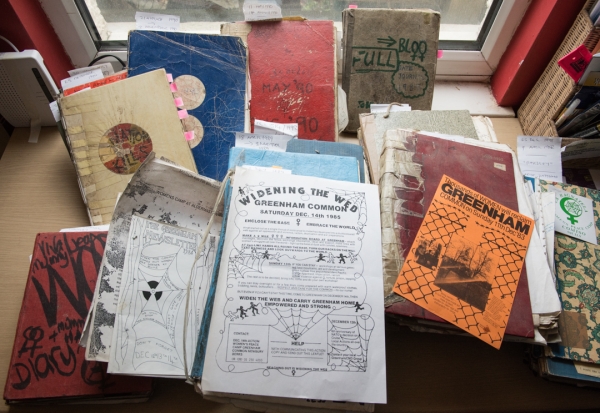
You are a GUI agent. You are given a task and a screenshot of the screen. Output one action in this format:
    pyautogui.click(x=<x>, y=<y>)
    Task: Click on the red wall
    
    Given the screenshot: What is the action you would take?
    (539, 47)